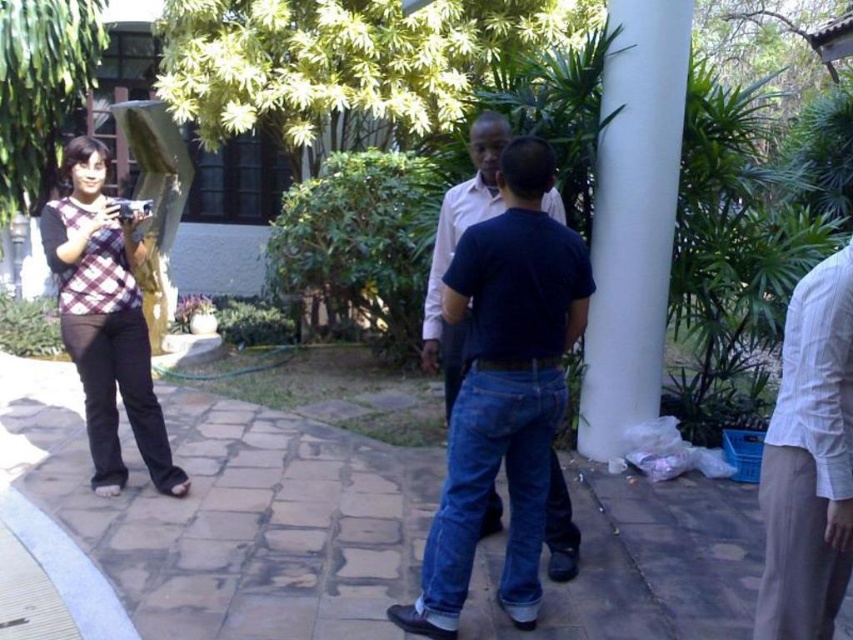
You are standing in the courtyard and want to take a photo of the white smooth pillar at center right and the plaid fabric top at left. Which object should you position closer to the left side of your camera frame?

You should position the plaid fabric top at left closer to the left side of your camera frame since it is located to the left of the white smooth pillar at center right.

You are standing in the courtyard and want to take a photo of the plaid fabric top at left. Where should you position yourself to ensure the top is centered in your camera view?

The plaid fabric top at left is located at point (105, 320), so you should position yourself directly in front of that coordinate to center it in your camera view.